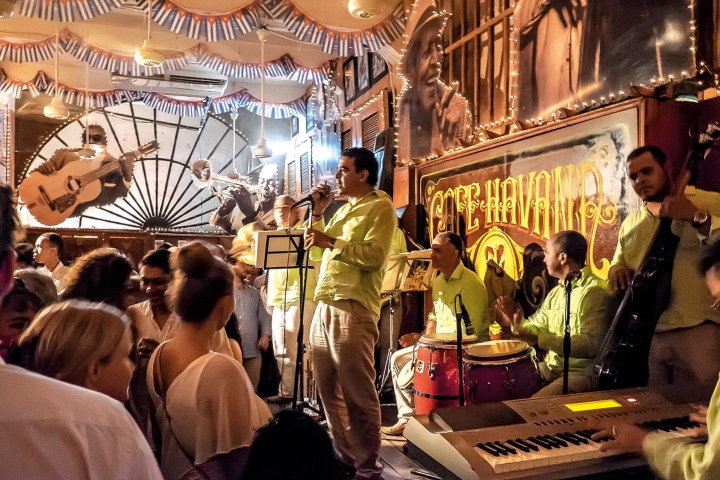
The width and height of the screenshot is (720, 480). I want to click on music stand, so click(x=274, y=245).